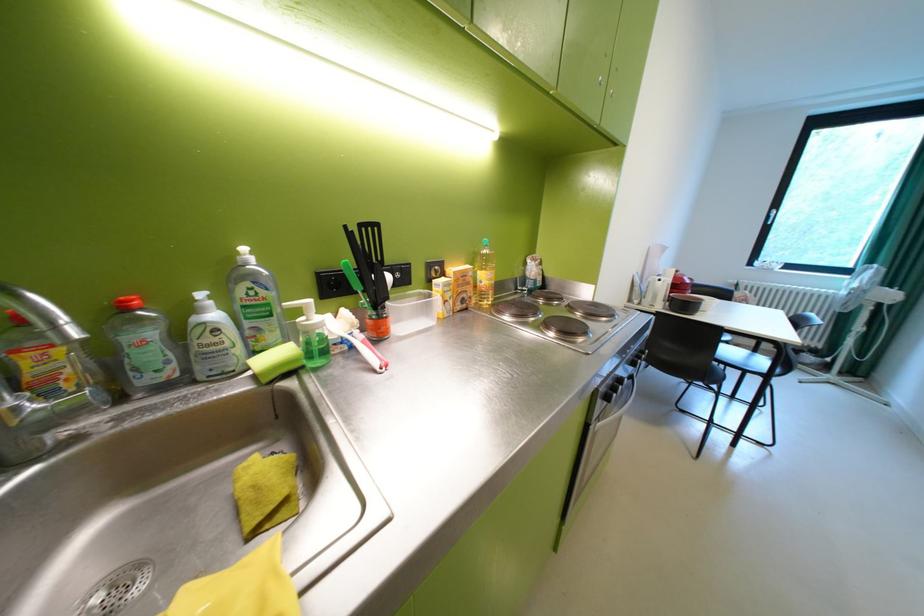
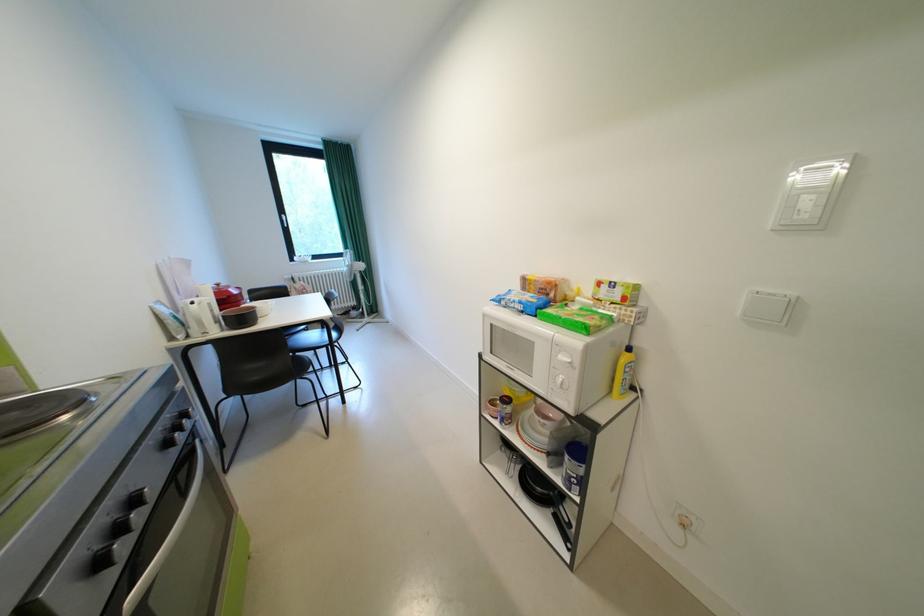
Where in the second image is the point corresponding to pixel 670 281 from the first image?

(203, 304)